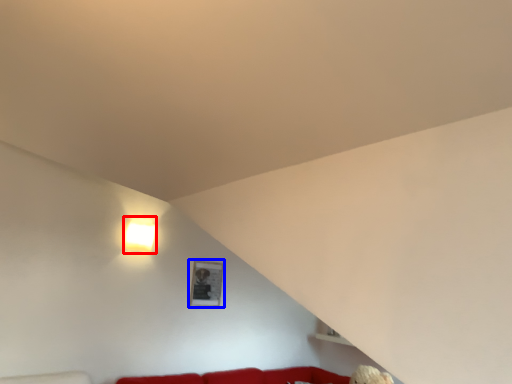
Question: Which object appears farthest to the camera in this image, lamp (highlighted by a red box) or picture frame (highlighted by a blue box)?

Choices:
 (A) lamp
 (B) picture frame

Answer: (B)